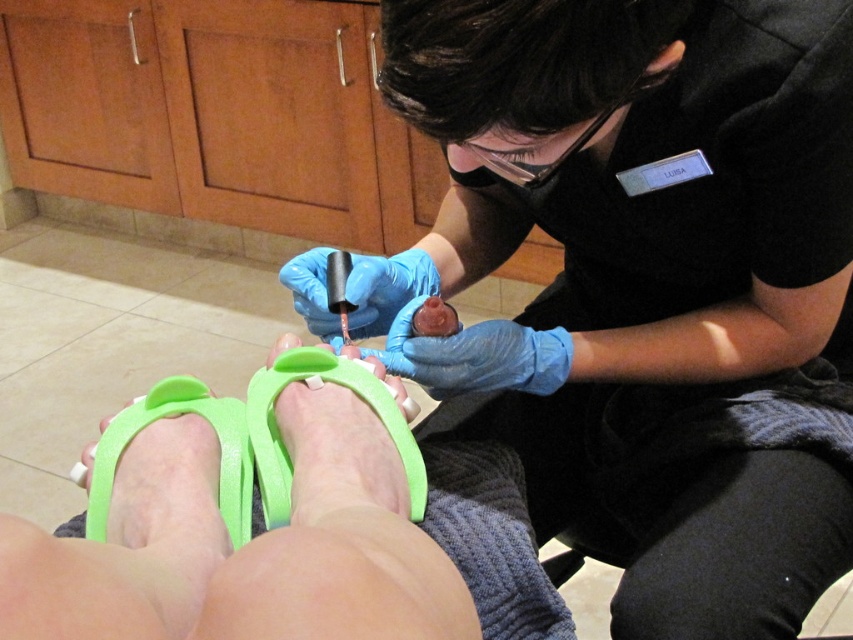
Which is in front, point (637, 76) or point (230, 410)?

Point (637, 76) is in front.

Is point (799, 19) positioned before point (126, 438)?

No.

Image resolution: width=853 pixels, height=640 pixels. In order to click on blue latex gloves at upper center in this screenshot , I will do `click(651, 284)`.

Does green rubber foot at lower left have a smaller size compared to glossy nail polish at center?

No, green rubber foot at lower left is not smaller than glossy nail polish at center.

Between point (231, 513) and point (337, 316), which one is positioned in front?

Point (231, 513) is in front.

Who is more forward, (x=248, y=522) or (x=294, y=276)?

Positioned in front is point (x=248, y=522).

This screenshot has width=853, height=640. In order to click on green rubber foot at lower left in this screenshot , I will do `click(170, 417)`.

Is green rubber foot at lower center shorter than green rubber foot at lower left?

No, green rubber foot at lower center is not shorter than green rubber foot at lower left.

Which of these two, green rubber foot at lower center or green rubber foot at lower left, stands shorter?

green rubber foot at lower left

Looking at this image, who is more forward, (291, 381) or (215, 422)?

Positioned in front is point (215, 422).

This screenshot has height=640, width=853. I want to click on green rubber foot at lower center, so click(x=320, y=385).